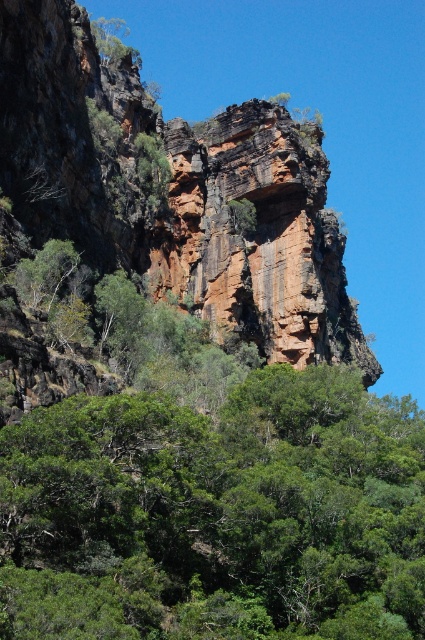
Which is in front, point (113, 572) or point (115, 36)?

Point (113, 572) is more forward.

Is green leafy tree at center shorter than green leafy tree at upper left?

Yes.

Where is `green leafy tree at center`? green leafy tree at center is located at coordinates (217, 513).

Identify the location of green leafy tree at center. (217, 513).